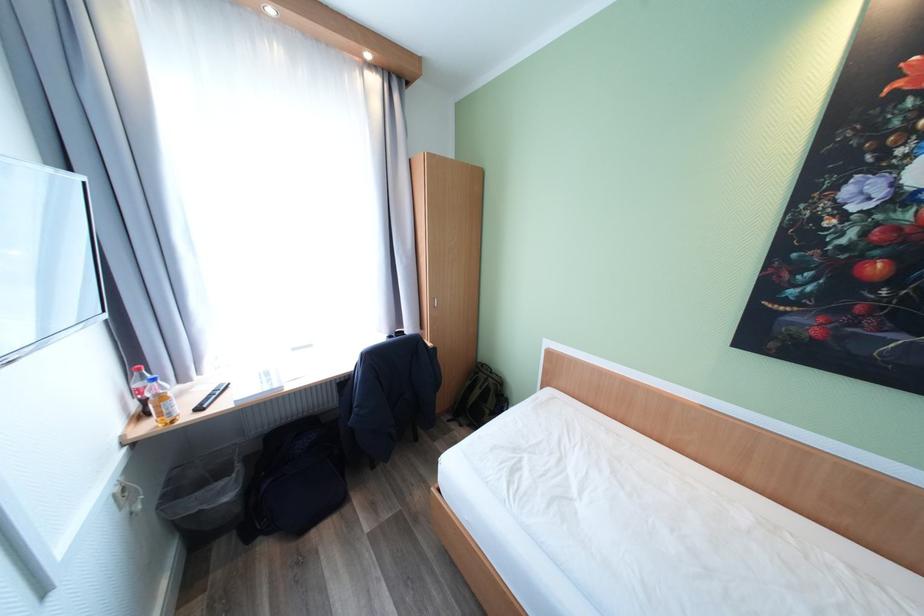
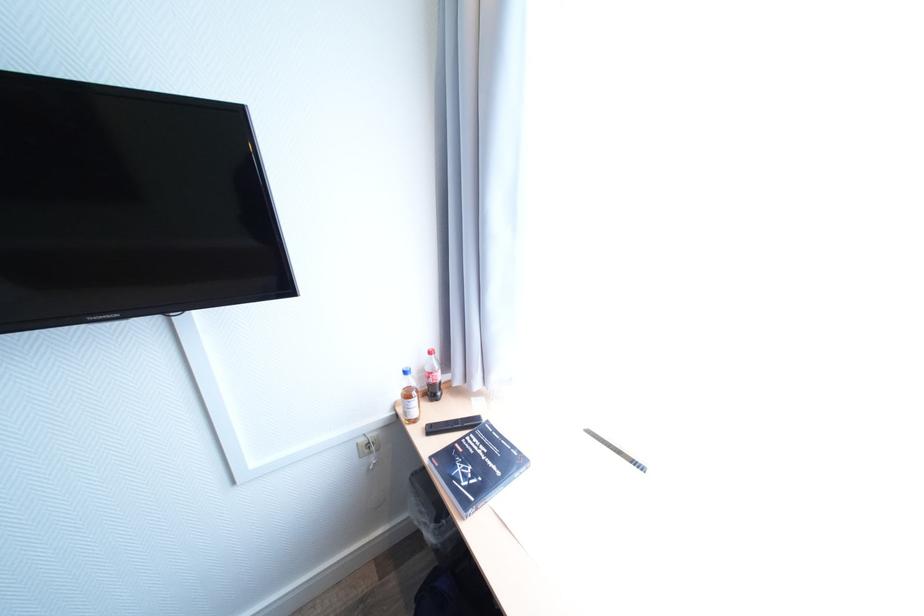
The point at (129, 438) is marked in the first image. Where is the corresponding point in the second image?

(403, 403)